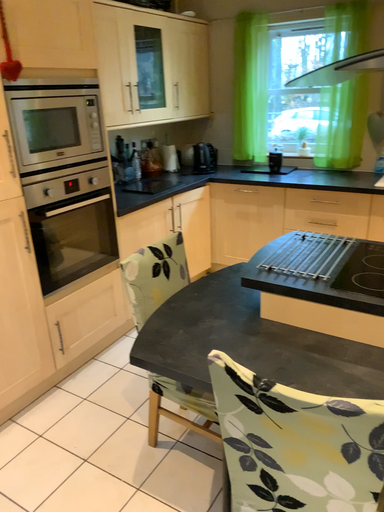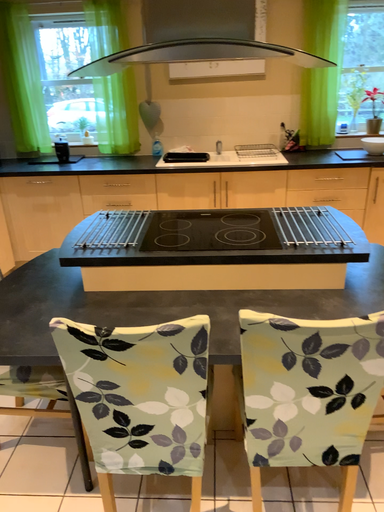
Question: How did the camera likely rotate when shooting the video?

Choices:
 (A) rotated left
 (B) rotated right

Answer: (B)